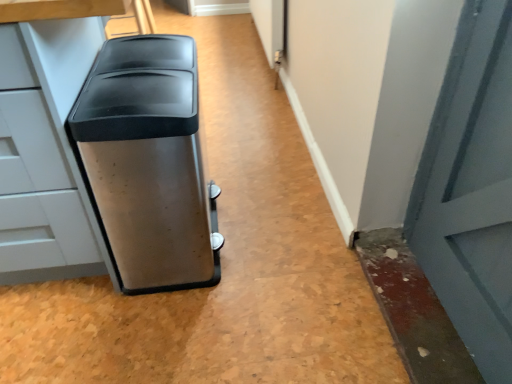
This screenshot has height=384, width=512. I want to click on vacant space behind stainless steel trash can at center, so (234, 165).